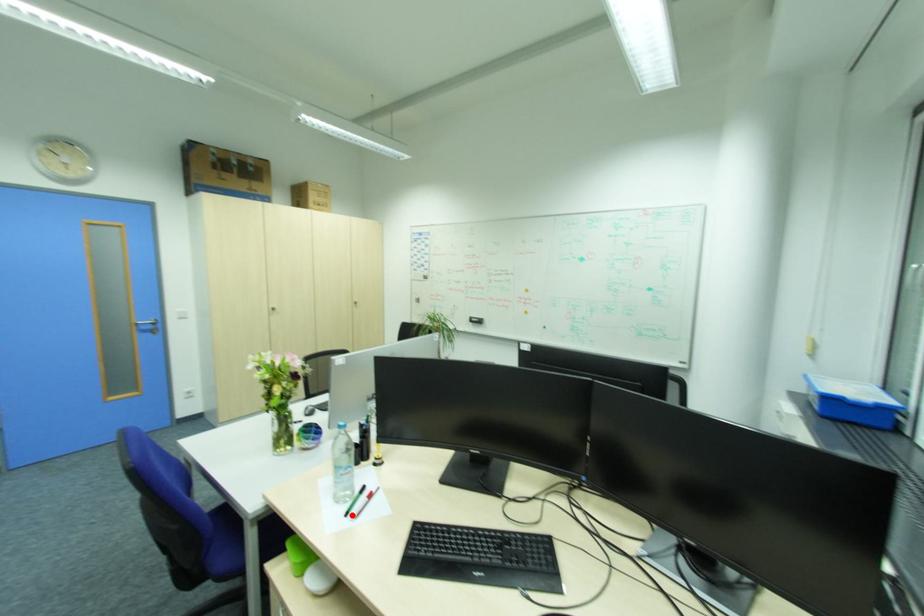
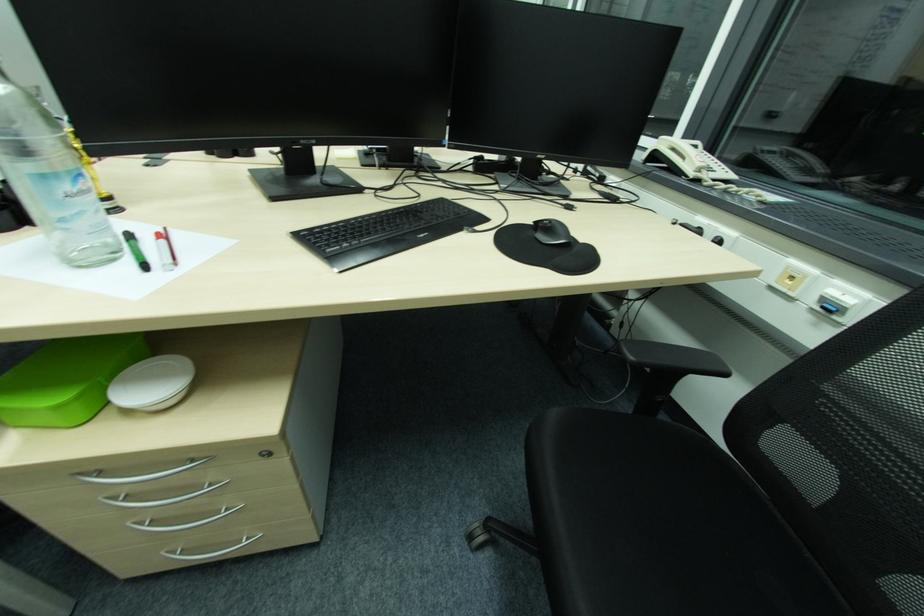
The point at the highlighted location is marked in the first image. Where is the corresponding point in the second image?

(149, 267)